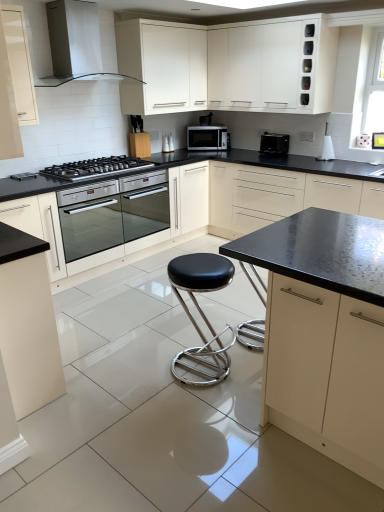
Consider the image. What is the approximate height of matte black countertop at center, arranged as the sixth cabinetry when viewed from the left?

matte black countertop at center, arranged as the sixth cabinetry when viewed from the left, is 35.17 inches tall.

I want to click on matte black countertop at center, arranged as the sixth cabinetry when viewed from the left, so click(x=265, y=189).

Where is `satin silver microwave at center, which is counted as the 1th kitchen appliance, starting from the left`? satin silver microwave at center, which is counted as the 1th kitchen appliance, starting from the left is located at coordinates (207, 138).

Locate an element on the screen. The image size is (384, 512). white glossy cabinet at upper center, acting as the third cabinetry starting from the right is located at coordinates (228, 66).

In order to face white glossy cabinet at upper center, arranged as the fourth cabinetry when viewed from the left, should I rotate leftwards or rightwards?

To align with it, rotate right about 8.710°.

This screenshot has width=384, height=512. Find the location of `white glossy range hood at upper left`. white glossy range hood at upper left is located at coordinates (76, 45).

Is black leather stool at center thinner than white glossy range hood at upper left?

Indeed, black leather stool at center has a lesser width compared to white glossy range hood at upper left.

Which is nearer, (182, 357) or (75, 0)?

The point (182, 357) is closer.

Is black leather stool at center facing towards white glossy range hood at upper left?

No, black leather stool at center does not turn towards white glossy range hood at upper left.

Identify the location of home appliance behind the black leather stool at center. This screenshot has height=512, width=384. (76, 45).

Which is behind, point (95, 221) or point (336, 241)?

The point (95, 221) is farther from the camera.

Can you confirm if stainless steel oven at center is bigger than black matte cabinet at center, which is counted as the 2th cabinetry, starting from the right?

No.

Is stainless steel oven at center situated inside black matte cabinet at center, arranged as the fifth cabinetry when viewed from the left, or outside?

Answer: stainless steel oven at center is not enclosed by black matte cabinet at center, arranged as the fifth cabinetry when viewed from the left.

The height and width of the screenshot is (512, 384). In order to click on oven positioned vertically above the black matte cabinet at center, arranged as the fifth cabinetry when viewed from the left (from a real-world perspective) in this screenshot , I will do `click(111, 217)`.

Visually, is white glossy cabinet at upper center, arranged as the fourth cabinetry when viewed from the left, positioned to the left or to the right of matte black countertop at center, the 1th cabinetry in the right-to-left sequence?

white glossy cabinet at upper center, arranged as the fourth cabinetry when viewed from the left, is positioned on matte black countertop at center, the 1th cabinetry in the right-to-left sequence,'s left side.

Does point (145, 31) lie behind point (182, 185)?

No, (145, 31) is in front of (182, 185).

Could you tell me if white glossy cabinet at upper center, acting as the third cabinetry starting from the right, is turned towards matte black countertop at center, the 1th cabinetry in the right-to-left sequence?

No, white glossy cabinet at upper center, acting as the third cabinetry starting from the right, is not turned towards matte black countertop at center, the 1th cabinetry in the right-to-left sequence.

Is white glossy cabinet at upper center, arranged as the fourth cabinetry when viewed from the left, not inside matte black countertop at center, arranged as the sixth cabinetry when viewed from the left?

white glossy cabinet at upper center, arranged as the fourth cabinetry when viewed from the left, is positioned outside matte black countertop at center, arranged as the sixth cabinetry when viewed from the left.

From a real-world perspective, is satin silver microwave at center, which is counted as the 1th kitchen appliance, starting from the left, physically above stainless steel oven at center?

Yes, from a real-world perspective, satin silver microwave at center, which is counted as the 1th kitchen appliance, starting from the left, is over stainless steel oven at center

Image resolution: width=384 pixels, height=512 pixels. In the image, there is a satin silver microwave at center, the second kitchen appliance in the right-to-left sequence. Identify the location of oven below it (from a real-world perspective). click(111, 217).

Is satin silver microwave at center, the 1th kitchen appliance viewed from the back, touching stainless steel oven at center?

No, satin silver microwave at center, the 1th kitchen appliance viewed from the back, is not beside stainless steel oven at center.

From the image's perspective, which is below, satin silver microwave at center, marked as the second kitchen appliance in a front-to-back arrangement, or stainless steel oven at center?

stainless steel oven at center.

From a real-world perspective, who is located lower, black plastic toaster at upper right, placed as the first kitchen appliance when sorted from right to left, or black stainless steel gas stove at left?

black stainless steel gas stove at left, from a real-world perspective.

From the image's perspective, which is above, black plastic toaster at upper right, placed as the first kitchen appliance when sorted from right to left, or black stainless steel gas stove at left?

black plastic toaster at upper right, placed as the first kitchen appliance when sorted from right to left.

Could you tell me if black plastic toaster at upper right, which is the second kitchen appliance in back-to-front order, is facing black stainless steel gas stove at left?

Yes, black plastic toaster at upper right, which is the second kitchen appliance in back-to-front order, is facing black stainless steel gas stove at left.

Is black plastic toaster at upper right, placed as the first kitchen appliance when sorted from right to left, thinner than black stainless steel gas stove at left?

Indeed, black plastic toaster at upper right, placed as the first kitchen appliance when sorted from right to left, has a lesser width compared to black stainless steel gas stove at left.

Considering the relative sizes of black stainless steel gas stove at left and matte cream cabinet at upper left, the first cabinetry from the left, in the image provided, is black stainless steel gas stove at left taller than matte cream cabinet at upper left, the first cabinetry from the left,?

No.

From the picture: Which is closer to the camera, (120, 174) or (12, 14)?

The point (12, 14) is in front.

Considering the positions of objects black stainless steel gas stove at left and matte cream cabinet at upper left, acting as the 6th cabinetry starting from the right, in the image provided, who is behind, black stainless steel gas stove at left or matte cream cabinet at upper left, acting as the 6th cabinetry starting from the right,?

Positioned behind is black stainless steel gas stove at left.

Is black stainless steel gas stove at left oriented towards matte cream cabinet at upper left, acting as the 6th cabinetry starting from the right?

No, black stainless steel gas stove at left is not facing towards matte cream cabinet at upper left, acting as the 6th cabinetry starting from the right.

Between point (67, 247) and point (221, 134), which one is positioned in front?

The point (67, 247) is more forward.

Is stainless steel oven at center further to camera compared to satin silver microwave at center, which is counted as the 1th kitchen appliance, starting from the left?

No, it is in front of satin silver microwave at center, which is counted as the 1th kitchen appliance, starting from the left.

Can you tell me how much stainless steel oven at center and satin silver microwave at center, the 1th kitchen appliance viewed from the back, differ in facing direction?

The angular difference between stainless steel oven at center and satin silver microwave at center, the 1th kitchen appliance viewed from the back, is 47.6 degrees.

From a real-world perspective, which object stands above the other?

In real-world perspective, satin silver microwave at center, which is counted as the 1th kitchen appliance, starting from the left, is above.

Where is `stool below the white glossy range hood at upper left (from the image's perspective)`? Image resolution: width=384 pixels, height=512 pixels. stool below the white glossy range hood at upper left (from the image's perspective) is located at coordinates (202, 315).

You are a GUI agent. You are given a task and a screenshot of the screen. Output one action in this format:
    pyautogui.click(x=<x>, y=<y>)
    Task: Click on the oven on the left of black matte cabinet at center, which is counted as the 2th cabinetry, starting from the right
    
    Given the screenshot: What is the action you would take?
    pyautogui.click(x=111, y=217)

Estimate the real-world distances between objects in this image. Which object is further from white glossy cabinet at upper center, acting as the third cabinetry starting from the right, satin silver microwave at center, the second kitchen appliance in the right-to-left sequence, or black plastic toaster at upper right, placed as the first kitchen appliance when sorted from right to left?

black plastic toaster at upper right, placed as the first kitchen appliance when sorted from right to left, lies further to white glossy cabinet at upper center, acting as the third cabinetry starting from the right, than the other object.

From the image, which object appears to be nearer to black stainless steel gas stove at left, black matte cabinet at center, arranged as the fifth cabinetry when viewed from the left, or matte white cabinet at lower left, which is the fifth cabinetry from right to left?

matte white cabinet at lower left, which is the fifth cabinetry from right to left, is closer to black stainless steel gas stove at left.

From the image, which object appears to be farther from black stainless steel gas stove at left, black leather stool at center or white glossy cabinet at upper center, arranged as the fourth cabinetry when viewed from the left?

black leather stool at center is further to black stainless steel gas stove at left.

Looking at the image, which one is located further to black matte cabinet at center, which is counted as the 2th cabinetry, starting from the right, black stainless steel gas stove at left or matte white cabinet at lower left, which is the fifth cabinetry from right to left?

black stainless steel gas stove at left is further to black matte cabinet at center, which is counted as the 2th cabinetry, starting from the right.

Considering their positions, is white glossy range hood at upper left positioned further to black leather stool at center than stainless steel oven at center?

white glossy range hood at upper left is positioned further to the anchor black leather stool at center.

From the image, which object appears to be farther from matte black countertop at center, arranged as the sixth cabinetry when viewed from the left, white glossy cabinet at upper center, arranged as the fourth cabinetry when viewed from the left, or satin silver microwave at center, the second kitchen appliance in the right-to-left sequence?

white glossy cabinet at upper center, arranged as the fourth cabinetry when viewed from the left, lies further to matte black countertop at center, arranged as the sixth cabinetry when viewed from the left, than the other object.

Looking at the image, which one is located closer to matte cream cabinet at upper left, acting as the 6th cabinetry starting from the right, black stainless steel gas stove at left or matte white cabinet at lower left, the 2th cabinetry when ordered from left to right?

black stainless steel gas stove at left.

Considering their positions, is matte black countertop at center, the 1th cabinetry in the right-to-left sequence, positioned closer to matte cream cabinet at upper left, acting as the 6th cabinetry starting from the right, than white glossy range hood at upper left?

white glossy range hood at upper left is positioned closer to the anchor matte cream cabinet at upper left, acting as the 6th cabinetry starting from the right.

At what (x,y) coordinates should I click in order to perform the action: click on home appliance located between black matte cabinet at center, which is counted as the 2th cabinetry, starting from the right, and satin silver microwave at center, marked as the second kitchen appliance in a front-to-back arrangement, in the depth direction. Please return your answer as a coordinate pair (x, y). Image resolution: width=384 pixels, height=512 pixels. Looking at the image, I should click on (76, 45).

Find the location of `stool between matte white cabinet at lower left, the 2th cabinetry when ordered from left to right, and black stainless steel gas stove at left from front to back`. stool between matte white cabinet at lower left, the 2th cabinetry when ordered from left to right, and black stainless steel gas stove at left from front to back is located at coordinates (202, 315).

The width and height of the screenshot is (384, 512). I want to click on oven between white glossy range hood at upper left and white glossy cabinet at upper center, arranged as the fourth cabinetry when viewed from the left, in the horizontal direction, so click(x=111, y=217).

Locate an element on the screen. Image resolution: width=384 pixels, height=512 pixels. oven between white glossy cabinet at upper center, arranged as the fourth cabinetry when viewed from the left, and black leather stool at center in the up-down direction is located at coordinates (111, 217).